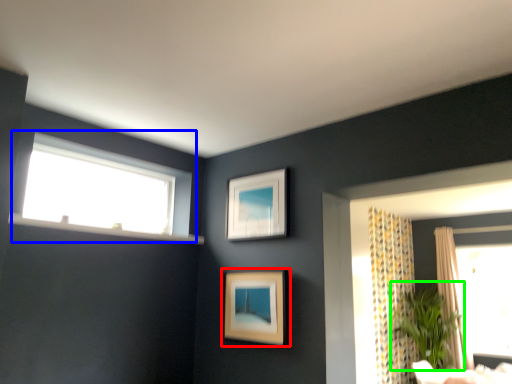
Question: Considering the real-world distances, which object is farthest from picture frame (highlighted by a red box)? window (highlighted by a blue box) or plant (highlighted by a green box)?

Choices:
 (A) window
 (B) plant

Answer: (B)